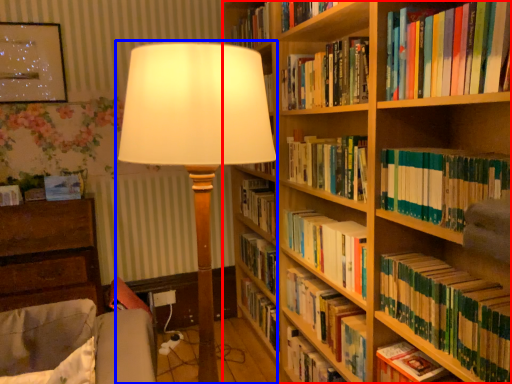
Question: Which point is further to the camera, bookcase (highlighted by a red box) or lamp (highlighted by a blue box)?

Choices:
 (A) bookcase
 (B) lamp

Answer: (B)